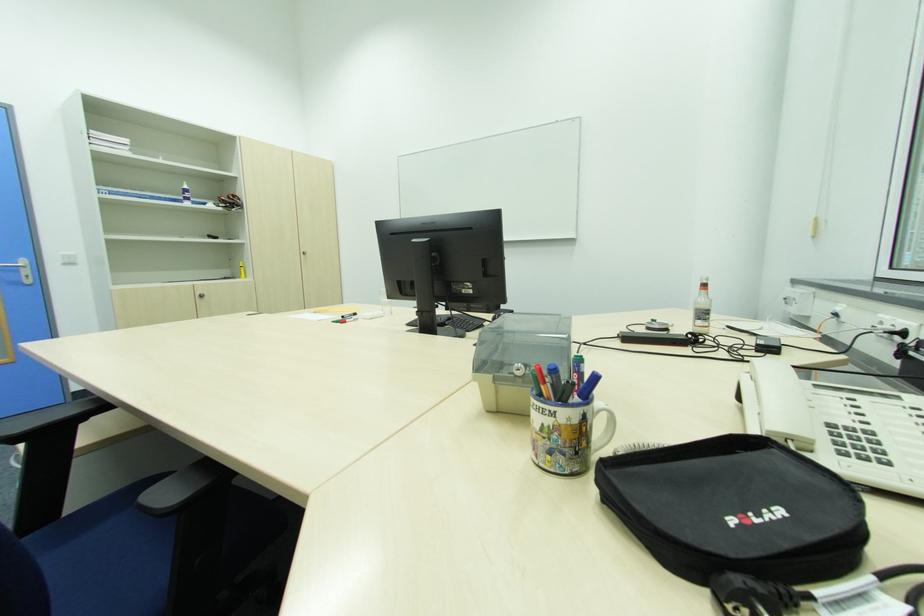
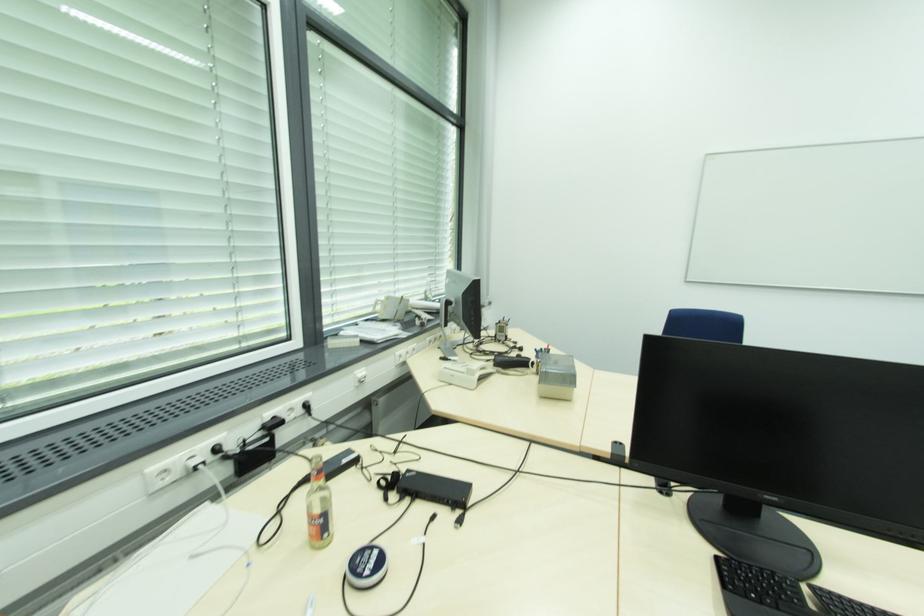
In the second image, find the point that corresponds to (883,323) in the first image.

(167, 472)